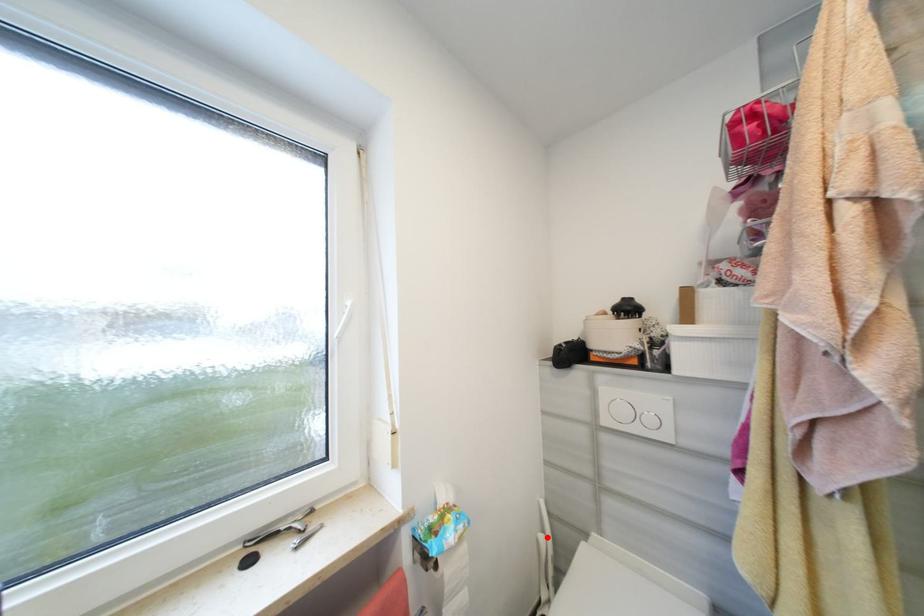
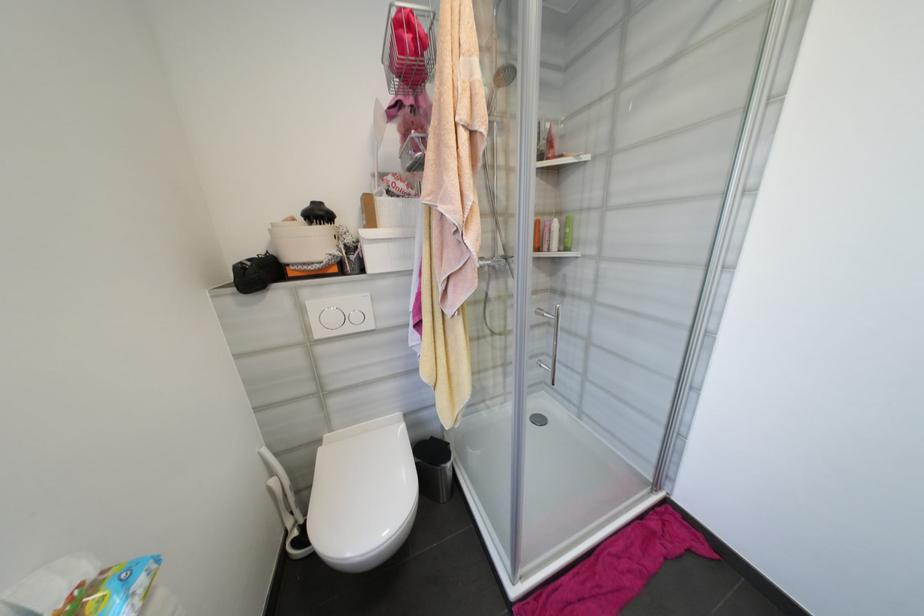
Question: I am providing you with two images of the same scene from different viewpoints. A red point is shown in image1. For the corresponding object point in image2, is it positioned nearer or farther from the camera?

Choices:
 (A) Nearer
 (B) Farther

Answer: (A)